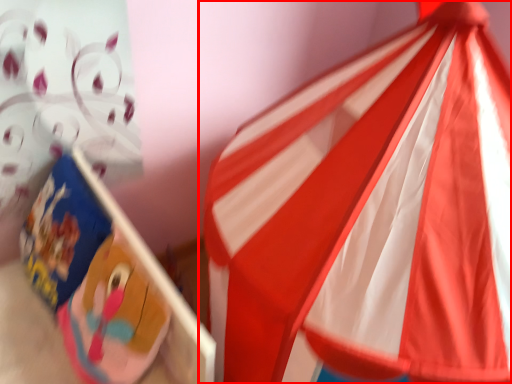
Question: In this image, where is flag (annotated by the red box) located relative to cardboard box?

Choices:
 (A) right
 (B) left

Answer: (A)